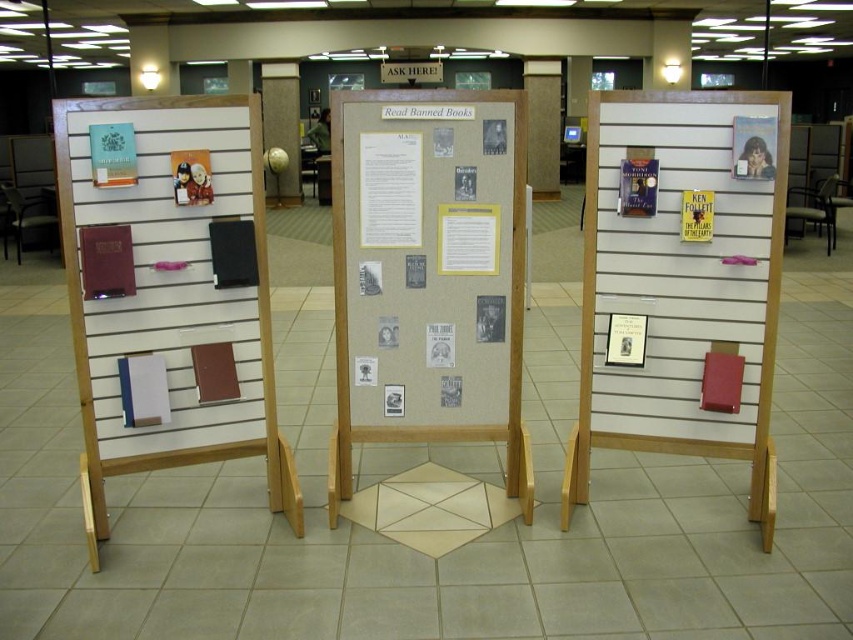
Does matte red book at right lie behind matte black chair at left?

No, matte red book at right is closer to the viewer.

Can you confirm if matte red book at right is shorter than matte black chair at left?

In fact, matte red book at right may be taller than matte black chair at left.

Which is in front, point (747, 420) or point (10, 198)?

Point (747, 420) is in front.

You are a GUI agent. You are given a task and a screenshot of the screen. Output one action in this format:
    pyautogui.click(x=<x>, y=<y>)
    Task: Click on the matte red book at right
    
    Given the screenshot: What is the action you would take?
    pyautogui.click(x=680, y=288)

Does matte blue book at left have a smaller size compared to matte paper poster at center?

No, matte blue book at left is not smaller than matte paper poster at center.

Is point (115, 138) closer to viewer compared to point (618, 317)?

That is True.

Is point (134, 176) positioned in front of point (614, 349)?

Yes, point (134, 176) is in front of point (614, 349).

Where is `matte blue book at left`? Image resolution: width=853 pixels, height=640 pixels. matte blue book at left is located at coordinates (112, 154).

Is matte wood bookshelf at left wider than matte wood globe at center?

Correct, the width of matte wood bookshelf at left exceeds that of matte wood globe at center.

Is matte wood bookshelf at left positioned in front of matte wood globe at center?

Yes, matte wood bookshelf at left is closer to the viewer.

Find the location of `matte wood bookshelf at left`. matte wood bookshelf at left is located at coordinates (172, 298).

This screenshot has width=853, height=640. Find the location of `matte wood bookshelf at left`. matte wood bookshelf at left is located at coordinates (172, 298).